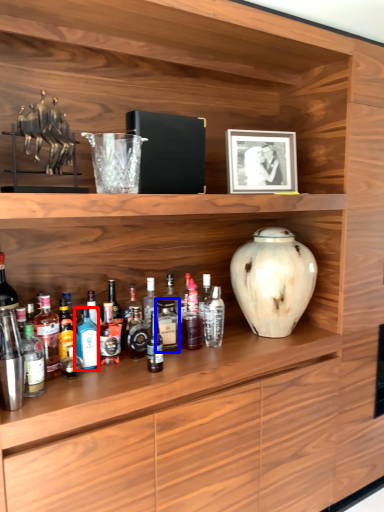
Question: Which object is further to the camera taking this photo, bottle (highlighted by a red box) or bottle (highlighted by a blue box)?

Choices:
 (A) bottle
 (B) bottle

Answer: (B)